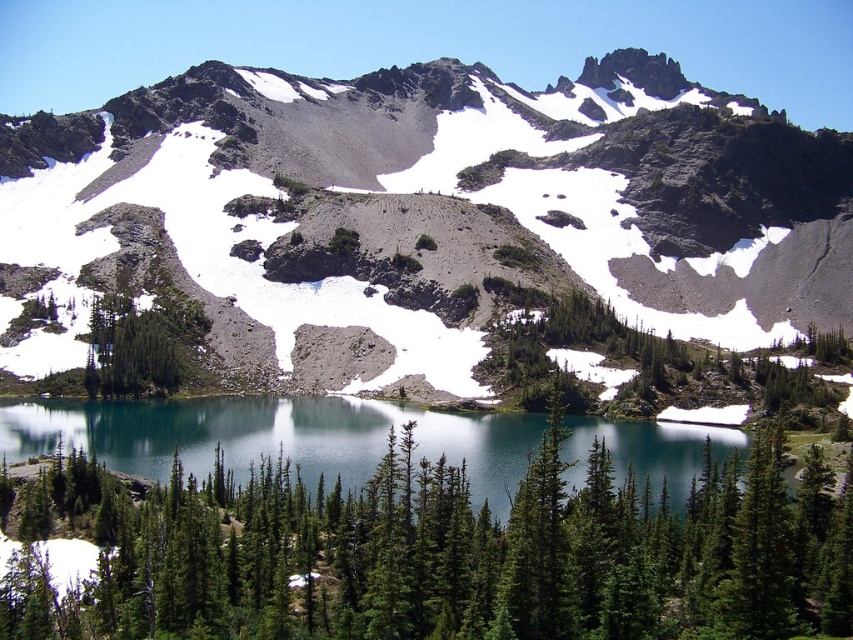
Does point (144, 476) come closer to viewer compared to point (96, 392)?

Yes, point (144, 476) is in front of point (96, 392).

Does green glassy water at center lie in front of green matte tree at center-left?

Yes.

Is point (376, 403) less distant than point (99, 362)?

No, (376, 403) is further to viewer.

The image size is (853, 640). I want to click on green glassy water at center, so coord(271,436).

Who is more distant from viewer, (585, 65) or (668, 458)?

The point (585, 65) is behind.

Does rugged granite mountain at center appear on the left side of green glassy water at center?

No, rugged granite mountain at center is not to the left of green glassy water at center.

Which is in front, point (804, 294) or point (86, 410)?

Positioned in front is point (86, 410).

Locate an element on the screen. The width and height of the screenshot is (853, 640). rugged granite mountain at center is located at coordinates (439, 209).

Find the location of a particular element. rugged granite mountain at center is located at coordinates [439, 209].

Who is shorter, rugged granite mountain at center or green matte tree at center?

green matte tree at center is shorter.

This screenshot has width=853, height=640. What do you see at coordinates (439, 209) in the screenshot? I see `rugged granite mountain at center` at bounding box center [439, 209].

At what (x,y) coordinates should I click in order to perform the action: click on rugged granite mountain at center. Please return your answer as a coordinate pair (x, y). The width and height of the screenshot is (853, 640). Looking at the image, I should click on (439, 209).